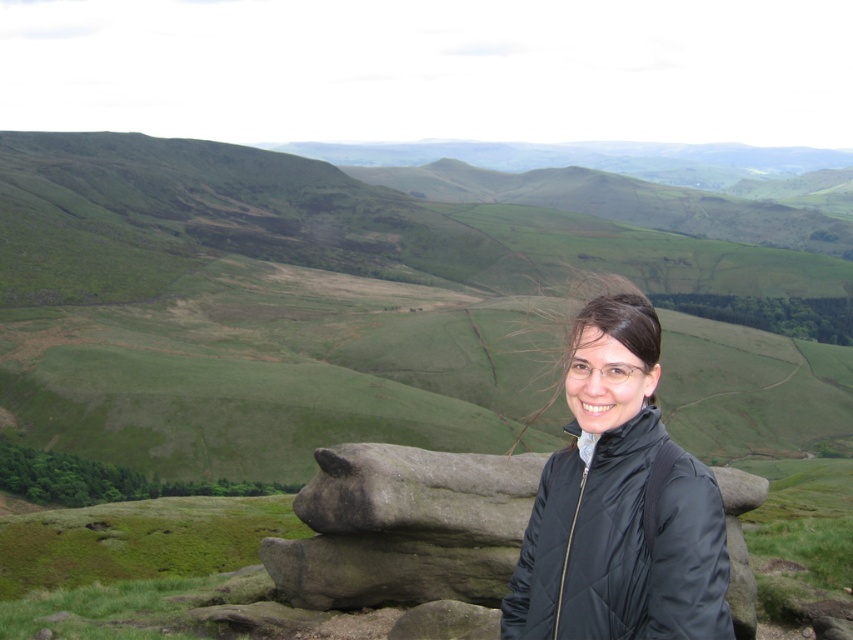
You are planning to set up a small tent for a picnic. You have two options for the location based on the image provided. The first option is on the green grassy hillside at center, and the second is on the rough stone boulder at center. Considering the size of the areas, which location would provide more space for your tent and picnic setup?

The green grassy hillside at center is larger in size than the rough stone boulder at center, so it would provide more space for setting up a tent and picnic.

You are planning to set up a picnic blanket in the scenic landscape. The picnic blanket is 2 meters wide. The green grassy hillside at center and the black quilted jacket at center are both in your view. Which location would be more suitable for placing the blanket based on their widths?

The green grassy hillside at center has a greater width than the black quilted jacket at center, so placing the picnic blanket on the green grassy hillside at center would be more suitable as it can accommodate the 2 meter width.